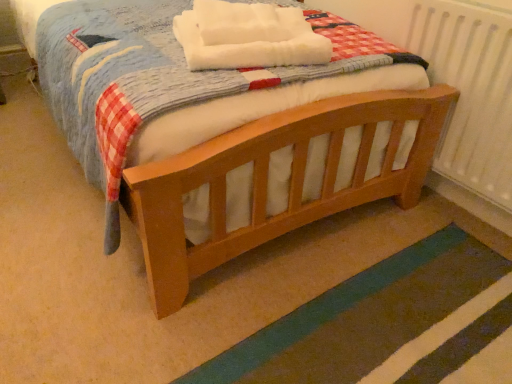
This screenshot has width=512, height=384. Find the location of `free location above white soft blanket at center (from a real-world perspective)`. free location above white soft blanket at center (from a real-world perspective) is located at coordinates (243, 22).